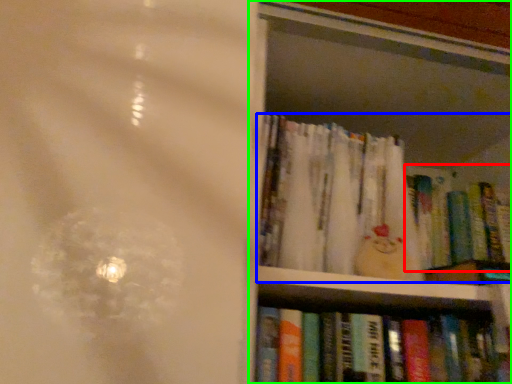
Question: Considering the real-world distances, which object is closest to book (highlighted by a red box)? book (highlighted by a blue box) or bookcase (highlighted by a green box).

Choices:
 (A) book
 (B) bookcase

Answer: (A)